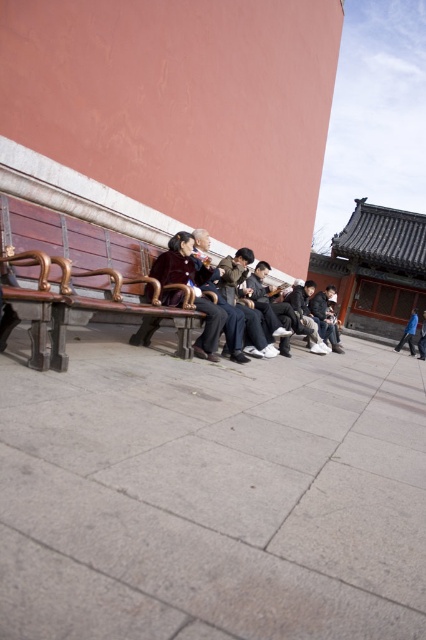
Question: Is dark brown leather jacket at center closer to the viewer compared to dark blue jacket at center?

Choices:
 (A) no
 (B) yes

Answer: (B)

Question: Estimate the real-world distances between objects in this image. Which object is closer to the dark brown leather jacket at center?

Choices:
 (A) dark blue jacket at center
 (B) velvet-like brown coat at center
 (C) blue denim jeans at lower right

Answer: (B)

Question: Can you confirm if velvet-like brown coat at center is wider than blue denim jeans at lower right?

Choices:
 (A) no
 (B) yes

Answer: (B)

Question: Which object is the closest to the dark brown leather jacket at center?

Choices:
 (A) velvet-like brown coat at center
 (B) dark blue jacket at center

Answer: (A)

Question: Does velvet-like brown coat at center have a larger size compared to blue denim jeans at lower right?

Choices:
 (A) yes
 (B) no

Answer: (A)

Question: Which object is the farthest from the dark brown leather jacket at center?

Choices:
 (A) blue denim jeans at lower right
 (B) velvet-like brown coat at center
 (C) dark blue jacket at center

Answer: (A)